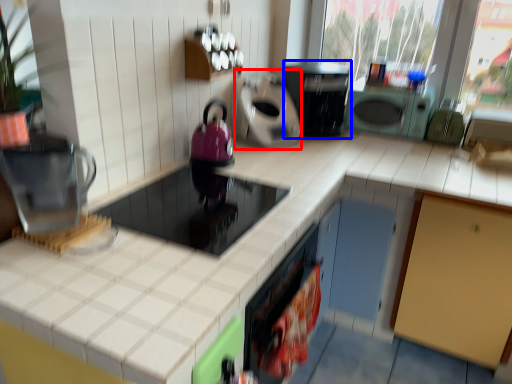
Question: Which point is closer to the camera, appliance (highlighted by a red box) or home appliance (highlighted by a blue box)?

Choices:
 (A) appliance
 (B) home appliance

Answer: (A)